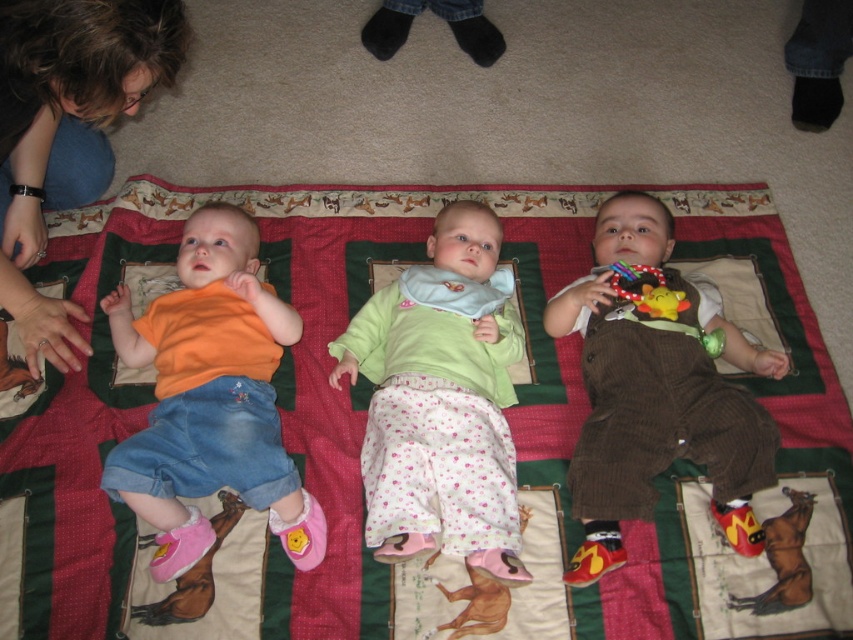
Question: Does light green fabric at center have a larger size compared to rubber teething ring at lower left?

Choices:
 (A) no
 (B) yes

Answer: (B)

Question: Which is nearer to the rubber teething ring at lower left?

Choices:
 (A) brown hair at upper left
 (B) light green fabric at center
 (C) rubberized plastic rattle at center

Answer: (A)

Question: Observing the image, what is the correct spatial positioning of multicolored quilt at center in reference to brown hair at upper left?

Choices:
 (A) below
 (B) above

Answer: (A)

Question: Which object is closer to the camera taking this photo?

Choices:
 (A) rubber teething ring at lower left
 (B) brown corduroy overalls at center

Answer: (B)

Question: Is multicolored quilt at center bigger than brown corduroy overalls at center?

Choices:
 (A) yes
 (B) no

Answer: (A)

Question: Which object appears closest to the camera in this image?

Choices:
 (A) multicolored quilt at center
 (B) orange cotton shirt at left
 (C) light green fabric at center
 (D) brown hair at upper left

Answer: (D)